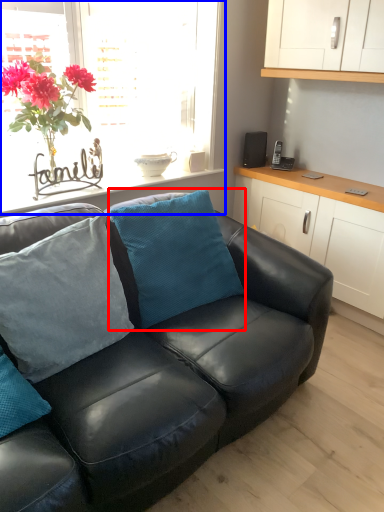
Question: Among these objects, which one is farthest to the camera, pillow (highlighted by a red box) or window (highlighted by a blue box)?

Choices:
 (A) pillow
 (B) window

Answer: (B)